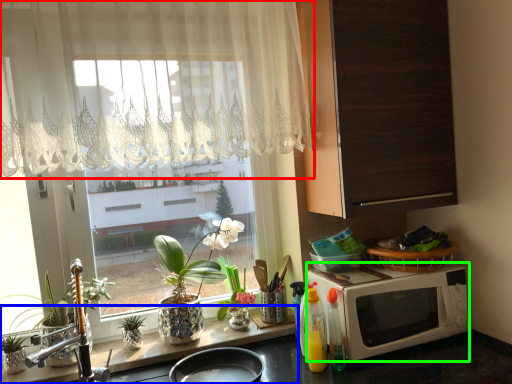
Question: Based on their relative distances, which object is farther from curtain (highlighted by a red box)? Choose from counter top (highlighted by a blue box) and microwave oven (highlighted by a green box).

Choices:
 (A) counter top
 (B) microwave oven

Answer: (A)